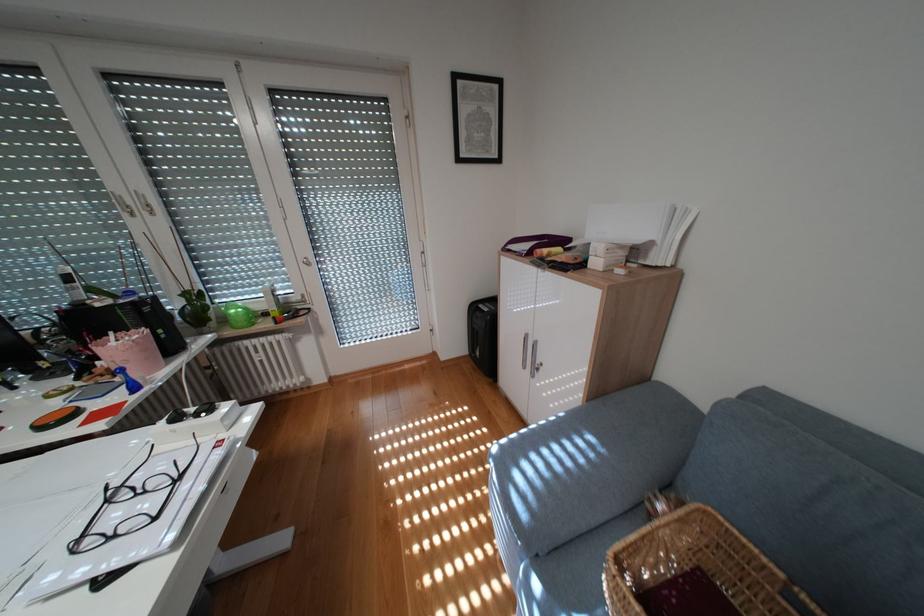
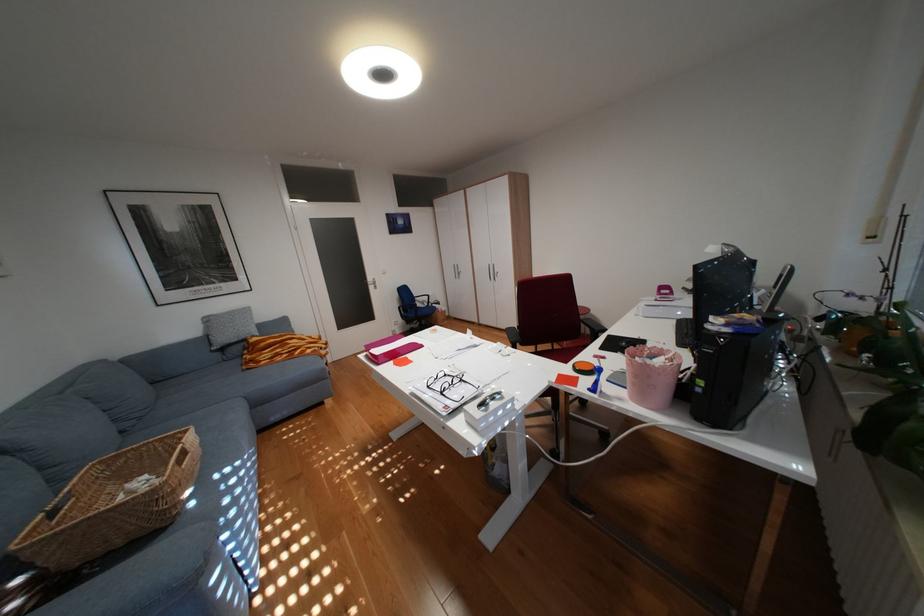
Locate, in the second image, the point that corresponds to point (189, 479) in the first image.

(454, 392)